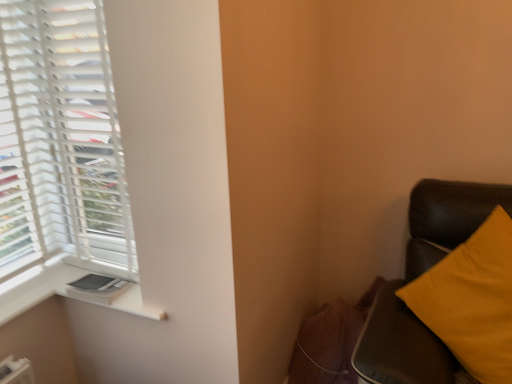
Question: Could you tell me if matte yellow pillow at right is facing white matte blinds at left?

Choices:
 (A) no
 (B) yes

Answer: (A)

Question: Does matte yellow pillow at right lie behind white matte blinds at left?

Choices:
 (A) no
 (B) yes

Answer: (A)

Question: Is white matte blinds at left surrounded by matte yellow pillow at right?

Choices:
 (A) no
 (B) yes

Answer: (A)

Question: Considering the relative sizes of matte yellow pillow at right and white matte blinds at left in the image provided, is matte yellow pillow at right taller than white matte blinds at left?

Choices:
 (A) no
 (B) yes

Answer: (A)

Question: From a real-world perspective, is matte yellow pillow at right under white matte blinds at left?

Choices:
 (A) no
 (B) yes

Answer: (B)

Question: Is matte yellow pillow at right in front of or behind white matte blinds at left in the image?

Choices:
 (A) front
 (B) behind

Answer: (A)

Question: In terms of width, does matte yellow pillow at right look wider or thinner when compared to white matte blinds at left?

Choices:
 (A) thin
 (B) wide

Answer: (B)

Question: Is matte yellow pillow at right inside the boundaries of white matte blinds at left, or outside?

Choices:
 (A) outside
 (B) inside

Answer: (A)

Question: From a real-world perspective, is matte yellow pillow at right physically located above or below white matte blinds at left?

Choices:
 (A) below
 (B) above

Answer: (A)

Question: Would you say white plastic window sill at lower left is to the left or to the right of matte yellow pillow at right in the picture?

Choices:
 (A) right
 (B) left

Answer: (B)

Question: In the image, is white plastic window sill at lower left positioned in front of or behind matte yellow pillow at right?

Choices:
 (A) behind
 (B) front

Answer: (A)

Question: Looking at the image, does white plastic window sill at lower left seem bigger or smaller compared to matte yellow pillow at right?

Choices:
 (A) big
 (B) small

Answer: (B)

Question: Is white plastic window sill at lower left wider or thinner than matte yellow pillow at right?

Choices:
 (A) wide
 (B) thin

Answer: (A)

Question: Does point (39, 231) appear closer or farther from the camera than point (382, 370)?

Choices:
 (A) farther
 (B) closer

Answer: (A)

Question: Looking at the image, does white matte blinds at left seem bigger or smaller compared to matte yellow pillow at right?

Choices:
 (A) small
 (B) big

Answer: (A)